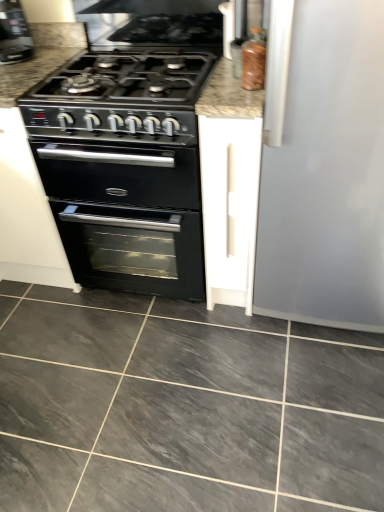
What do you see at coordinates (183, 407) in the screenshot?
I see `gray marble floor at center` at bounding box center [183, 407].

Locate an element on the screen. Image resolution: width=384 pixels, height=512 pixels. gray marble floor at center is located at coordinates 183,407.

At what (x,y) coordinates should I click in order to perform the action: click on white matte cabinet at center. Please return your answer as a coordinate pair (x, y). Looking at the image, I should click on (230, 207).

Locate an element on the screen. This screenshot has height=512, width=384. marble countertop at center is located at coordinates tap(41, 58).

Where is `black plastic coffee machine at upper left`? black plastic coffee machine at upper left is located at coordinates 14,33.

Image resolution: width=384 pixels, height=512 pixels. I want to click on ceramic tile located underneath the black matte oven at center (from a real-world perspective), so click(x=183, y=407).

Can you see black matte oven at center touching gray marble floor at center?

black matte oven at center and gray marble floor at center are clearly separated.

Is black matte oven at center oriented away from gray marble floor at center?

No, black matte oven at center's orientation is not away from gray marble floor at center.

Which of these two, black matte oven at center or gray marble floor at center, is bigger?

black matte oven at center.

Which is more distant, (42, 69) or (111, 359)?

The point (111, 359) is behind.

Where is `ceramic tile below the marble countertop at center (from the image's perspective)`? ceramic tile below the marble countertop at center (from the image's perspective) is located at coordinates (183, 407).

How many degrees apart are the facing directions of marble countertop at center and gray marble floor at center?

The angular difference between marble countertop at center and gray marble floor at center is 89.3 degrees.

Considering the sizes of objects marble countertop at center and gray marble floor at center in the image provided, who is bigger, marble countertop at center or gray marble floor at center?

Bigger between the two is gray marble floor at center.

Which point is more distant from viewer, [229,68] or [245,221]?

The point [245,221] is farther.

Is marble countertop at center not within white matte cabinet at center?

Yes, marble countertop at center is outside of white matte cabinet at center.

Is the position of marble countertop at center less distant than that of white matte cabinet at center?

That is False.

Could you tell me if marble countertop at center is turned towards white matte cabinet at center?

No.

Which is more to the right, gray marble floor at center or black matte oven at center?

Positioned to the right is gray marble floor at center.

From a real-world perspective, between gray marble floor at center and black matte oven at center, who is vertically lower?

From a 3D spatial view, gray marble floor at center is below.

Is gray marble floor at center further to camera compared to black matte oven at center?

That is False.

Is gray marble floor at center situated inside black matte oven at center or outside?

gray marble floor at center lies outside black matte oven at center.

Can you confirm if white matte cabinet at center is positioned to the left of marble countertop at center?

No.

From the image's perspective, does white matte cabinet at center appear lower than marble countertop at center?

Yes.

Is white matte cabinet at center not within marble countertop at center?

Indeed, white matte cabinet at center is completely outside marble countertop at center.

Is black plastic coffee machine at upper left a part of gray marble floor at center?

No, black plastic coffee machine at upper left is not surrounded by gray marble floor at center.

How many degrees apart are the facing directions of gray marble floor at center and black plastic coffee machine at upper left?

They differ by 46.8 degrees in their facing directions.

In the scene shown: Considering the sizes of objects gray marble floor at center and black plastic coffee machine at upper left in the image provided, who is taller, gray marble floor at center or black plastic coffee machine at upper left?

With more height is black plastic coffee machine at upper left.

Is there a large distance between gray marble floor at center and black plastic coffee machine at upper left?

gray marble floor at center is far away from black plastic coffee machine at upper left.

From a real-world perspective, which is physically below, translucent amber bottle at upper right or white matte cabinet at center?

white matte cabinet at center.

Is translucent amber bottle at upper right looking in the opposite direction of white matte cabinet at center?

No, translucent amber bottle at upper right's orientation is not away from white matte cabinet at center.

Is white matte cabinet at center completely or partially inside translucent amber bottle at upper right?

No.

Considering the relative positions of translucent amber bottle at upper right and white matte cabinet at center in the image provided, is translucent amber bottle at upper right behind white matte cabinet at center?

That is True.

Identify the location of oven above the gray marble floor at center (from a real-world perspective). (127, 216).

Find the location of a particular element. This screenshot has width=384, height=512. ceramic tile on the left side of marble countertop at center is located at coordinates (183, 407).

Looking at the image, which one is located closer to black matte oven at center, gray marble floor at center or white matte cabinet at center?

Based on the image, white matte cabinet at center appears to be nearer to black matte oven at center.

Which object lies further to the anchor point white matte cabinet at center, translucent amber bottle at upper right or black plastic coffee machine at upper left?

The object further to white matte cabinet at center is black plastic coffee machine at upper left.

Looking at the image, which one is located closer to black plastic coffee machine at upper left, white matte cabinet at center or black matte oven at center?

black matte oven at center.

When comparing their distances from translucent amber bottle at upper right, does white matte cabinet at center or marble countertop at center seem closer?

white matte cabinet at center is positioned closer to the anchor translucent amber bottle at upper right.

From the image, which object appears to be nearer to black matte oven at center, translucent amber bottle at upper right or white matte cabinet at center?

white matte cabinet at center.

From the image, which object appears to be nearer to gray marble floor at center, marble countertop at center or black matte oven at center?

black matte oven at center is positioned closer to the anchor gray marble floor at center.

Looking at the image, which one is located closer to white matte cabinet at center, gray marble floor at center or black plastic coffee machine at upper left?

gray marble floor at center is positioned closer to the anchor white matte cabinet at center.

Considering their positions, is black matte oven at center positioned closer to black plastic coffee machine at upper left than white matte cabinet at center?

black matte oven at center is positioned closer to the anchor black plastic coffee machine at upper left.

The width and height of the screenshot is (384, 512). I want to click on oven that lies between marble countertop at center and gray marble floor at center from top to bottom, so click(127, 216).

At what (x,y) coordinates should I click in order to perform the action: click on counter top between black plastic coffee machine at upper left and white matte cabinet at center. Please return your answer as a coordinate pair (x, y). Looking at the image, I should click on (x=41, y=58).

The width and height of the screenshot is (384, 512). Find the location of `counter top between black plastic coffee machine at upper left and translucent amber bottle at upper right in the horizontal direction`. counter top between black plastic coffee machine at upper left and translucent amber bottle at upper right in the horizontal direction is located at coordinates (41, 58).

At what (x,y) coordinates should I click in order to perform the action: click on counter top situated between black matte oven at center and white matte cabinet at center from left to right. Please return your answer as a coordinate pair (x, y). Looking at the image, I should click on (41, 58).